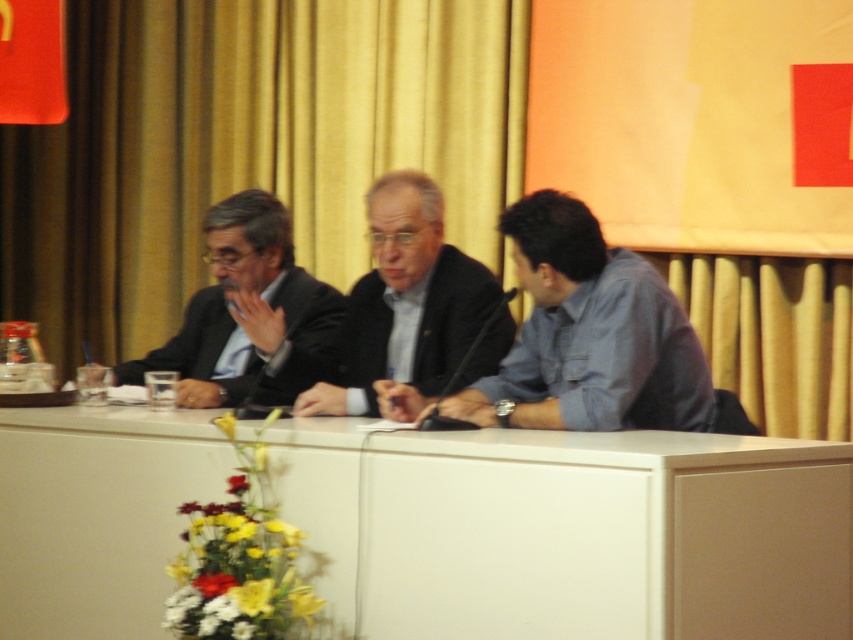
You are standing in the room and want to place a small vase on the white glossy table at center. However, there is a light blue shirt at center in your way. Which object should you move first to access the table?

You should move the light blue shirt at center first because it is closer to you than the white glossy table at center, so it is blocking your access to the table.

You are attending a meeting and need to pass a document to the person wearing the black matte suit at center and the matte black suit at left. Which one can you reach without moving from your current position?

The black matte suit at center is closer to the viewer than the matte black suit at left, so you can reach the person wearing the black matte suit at center without moving.